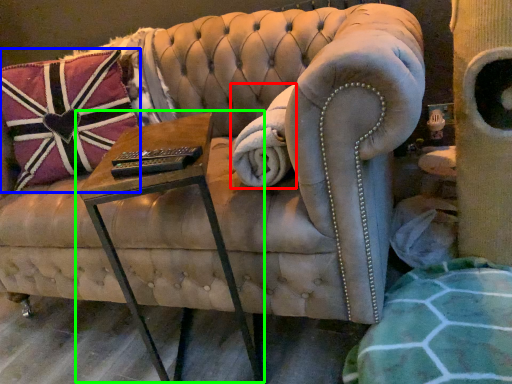
Question: Which is farther away from blanket (highlighted by a red box)? pillow (highlighted by a blue box) or table (highlighted by a green box)?

Choices:
 (A) pillow
 (B) table

Answer: (A)